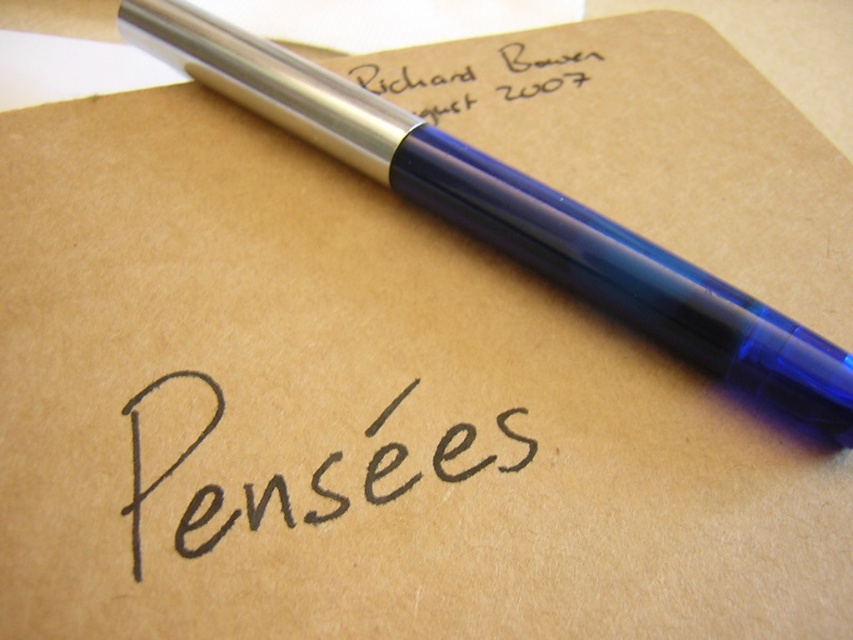
Can you confirm if transparent blue pen at upper center is thinner than black ink writing at center?

No, transparent blue pen at upper center is not thinner than black ink writing at center.

Is point (170, 42) positioned behind point (169, 512)?

Yes, it is behind point (169, 512).

Describe the element at coordinates (514, 216) in the screenshot. I see `transparent blue pen at upper center` at that location.

Identify the location of transparent blue pen at upper center. (514, 216).

Who is positioned more to the right, black ink writing at center or silver metallic pen at upper right?

silver metallic pen at upper right is more to the right.

Where is `black ink writing at center`? This screenshot has width=853, height=640. black ink writing at center is located at coordinates (292, 467).

The width and height of the screenshot is (853, 640). What are the coordinates of `black ink writing at center` in the screenshot? It's located at (292, 467).

Is point (656, 266) positioned in front of point (544, 77)?

Yes, point (656, 266) is in front of point (544, 77).

Does transparent blue pen at upper center have a lesser width compared to silver metallic pen at upper right?

No, transparent blue pen at upper center is not thinner than silver metallic pen at upper right.

Between point (613, 262) and point (553, 51), which one is positioned in front?

Positioned in front is point (613, 262).

This screenshot has width=853, height=640. Find the location of `transparent blue pen at upper center`. transparent blue pen at upper center is located at coordinates (514, 216).